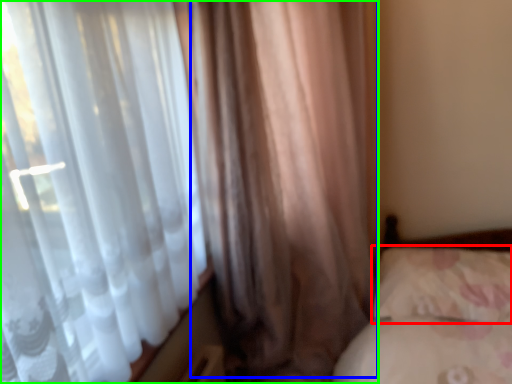
Question: Which object is the closest to the pillow (highlighted by a red box)? Choose among these: curtain (highlighted by a blue box) or curtain (highlighted by a green box).

Choices:
 (A) curtain
 (B) curtain

Answer: (A)